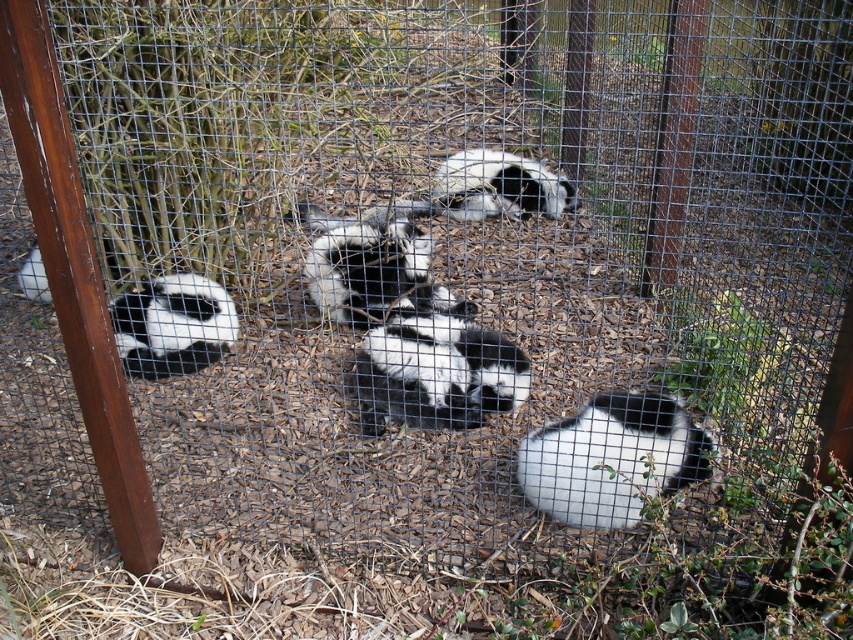
Question: Which of these objects is positioned farthest from the black and white fur panda at left?

Choices:
 (A) black glossy panda at center
 (B) black and white fur at center

Answer: (B)

Question: Which of the following is the closest to the observer?

Choices:
 (A) (160, 321)
 (B) (602, 460)
 (C) (514, 355)
 (D) (560, 209)

Answer: (B)

Question: Can you confirm if black and white fur panda at left is positioned above black and white fur at center?

Choices:
 (A) no
 (B) yes

Answer: (A)

Question: Is soft fur panda at lower right bigger than black and white fur at center?

Choices:
 (A) yes
 (B) no

Answer: (B)

Question: Which object appears farthest from the camera in this image?

Choices:
 (A) black glossy panda at center
 (B) soft fur panda at lower right

Answer: (A)

Question: Does black and white fur panda at left have a larger size compared to black and white fur at center?

Choices:
 (A) no
 (B) yes

Answer: (A)